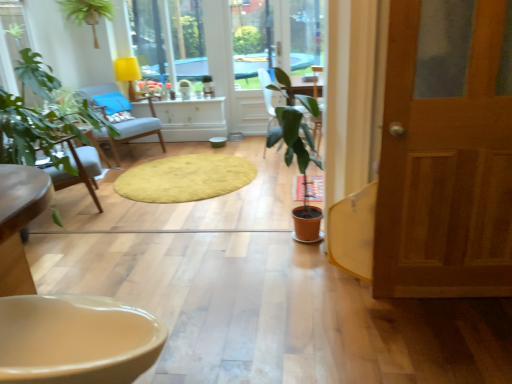
Question: Is the position of yellow soft rug at center less distant than that of light blue fabric chair at center?

Choices:
 (A) yes
 (B) no

Answer: (A)

Question: Considering the relative sizes of yellow soft rug at center and light blue fabric chair at center in the image provided, is yellow soft rug at center shorter than light blue fabric chair at center?

Choices:
 (A) yes
 (B) no

Answer: (A)

Question: Is yellow soft rug at center not inside light blue fabric chair at center?

Choices:
 (A) no
 (B) yes

Answer: (B)

Question: Is yellow soft rug at center with light blue fabric chair at center?

Choices:
 (A) no
 (B) yes

Answer: (A)

Question: Is yellow soft rug at center oriented away from light blue fabric chair at center?

Choices:
 (A) yes
 (B) no

Answer: (B)

Question: Is yellow fabric lampshade at upper center spatially inside beige glossy sink at lower left, or outside of it?

Choices:
 (A) inside
 (B) outside

Answer: (B)

Question: Is yellow fabric lampshade at upper center wider or thinner than beige glossy sink at lower left?

Choices:
 (A) wide
 (B) thin

Answer: (B)

Question: From a real-world perspective, relative to beige glossy sink at lower left, is yellow fabric lampshade at upper center vertically above or below?

Choices:
 (A) below
 (B) above

Answer: (B)

Question: Based on their positions, is yellow fabric lampshade at upper center located to the left or right of beige glossy sink at lower left?

Choices:
 (A) left
 (B) right

Answer: (A)

Question: From the image's perspective, relative to yellow soft rug at center, is beige glossy sink at lower left above or below?

Choices:
 (A) above
 (B) below

Answer: (B)

Question: Is point (119, 334) positioned closer to the camera than point (156, 193)?

Choices:
 (A) farther
 (B) closer

Answer: (B)

Question: Considering the positions of beige glossy sink at lower left and yellow soft rug at center in the image, is beige glossy sink at lower left taller or shorter than yellow soft rug at center?

Choices:
 (A) short
 (B) tall

Answer: (B)

Question: Choose the correct answer: Is beige glossy sink at lower left inside yellow soft rug at center or outside it?

Choices:
 (A) outside
 (B) inside

Answer: (A)

Question: Is green matte plant at upper left, the second houseplant from the right, wider or thinner than light blue fabric chair at center?

Choices:
 (A) thin
 (B) wide

Answer: (A)

Question: Based on their positions, is green matte plant at upper left, which appears as the first houseplant when viewed from the back, located to the left or right of light blue fabric chair at center?

Choices:
 (A) left
 (B) right

Answer: (A)